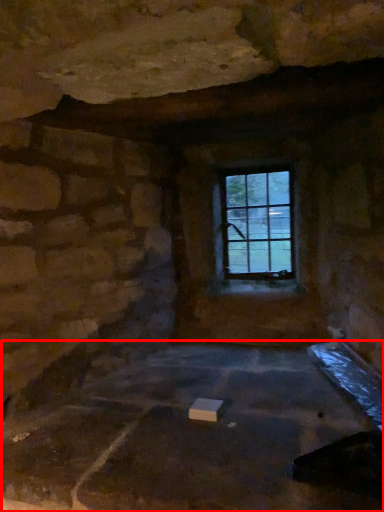
Question: From the image, what is the correct spatial relationship of foundation (annotated by the red box) in relation to window?

Choices:
 (A) right
 (B) left

Answer: (B)